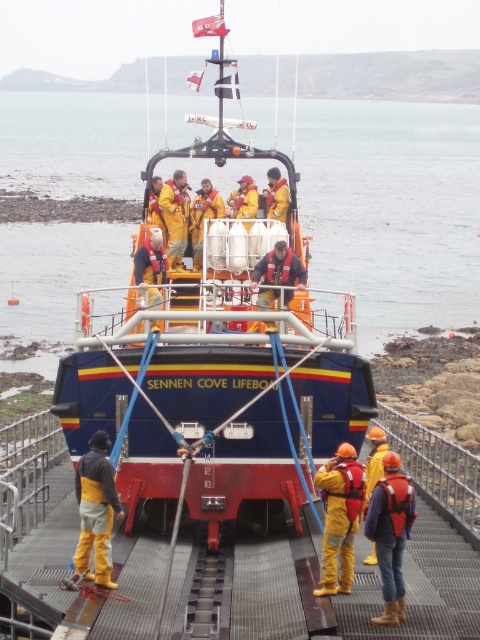
You are a lifeguard on duty at Sennen Cove. You notice the blue glossy water at center and the blue painted fiberglass Sennen Cove Lifeboat at center. Which object is positioned higher in the scene?

The blue glossy water at center is above the blue painted fiberglass Sennen Cove Lifeboat at center, so the blue glossy water at center is positioned higher in the scene.